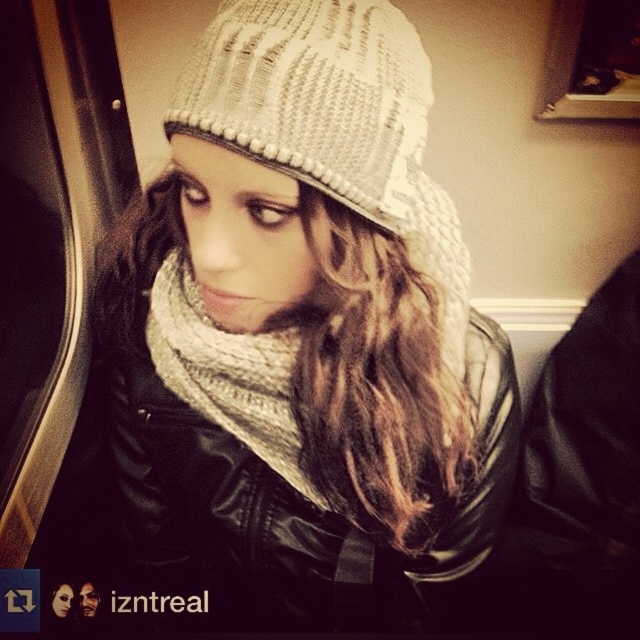
From the picture: You are a photographer holding a camera and want to take a closeup shot of the knitted beige hat at center. The camera requires a minimum distance of 18 inches to focus properly. Can you take the photo from your current position?

The knitted beige hat at center and camera are 19.14 inches apart from each other, which is more than the 18 inches required for the camera to focus. Therefore, you can take the photo from your current position.

You are a fashion designer observing a person wearing a knitted beige hat at center and a knitted beige scarf at center. Which item is placed higher on their body?

The knitted beige hat at center is positioned over the knitted beige scarf at center, so it is higher on their body.

You are a photographer trying to capture the knitted beige hat at center and the knitted beige scarf at center in a single shot. Since both are at the center, can you determine which one is more to the right?

The knitted beige hat at center is positioned on the right side of knitted beige scarf at center, so the knitted beige hat at center is more to the right.